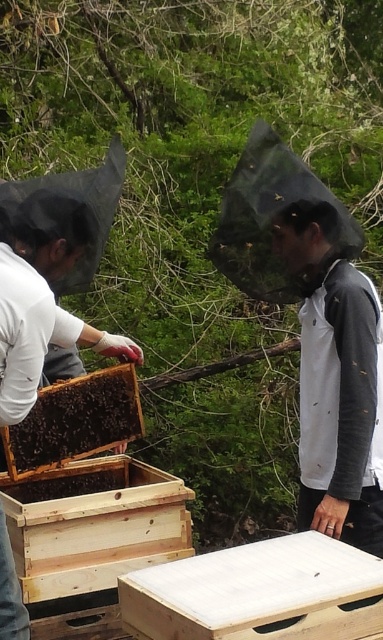
Question: Does white matte jacket at center have a greater width compared to dark brown wooden beehive at center?

Choices:
 (A) yes
 (B) no

Answer: (B)

Question: Which object appears closest to the camera in this image?

Choices:
 (A) dark brown wooden beehive at center
 (B) white matte jacket at center

Answer: (B)

Question: Considering the relative positions of white matte jacket at center and dark brown wooden beehive at center in the image provided, where is white matte jacket at center located with respect to dark brown wooden beehive at center?

Choices:
 (A) above
 (B) below

Answer: (A)

Question: From the image, what is the correct spatial relationship of white matte jacket at center in relation to dark brown wooden beehive at center?

Choices:
 (A) above
 (B) below

Answer: (A)